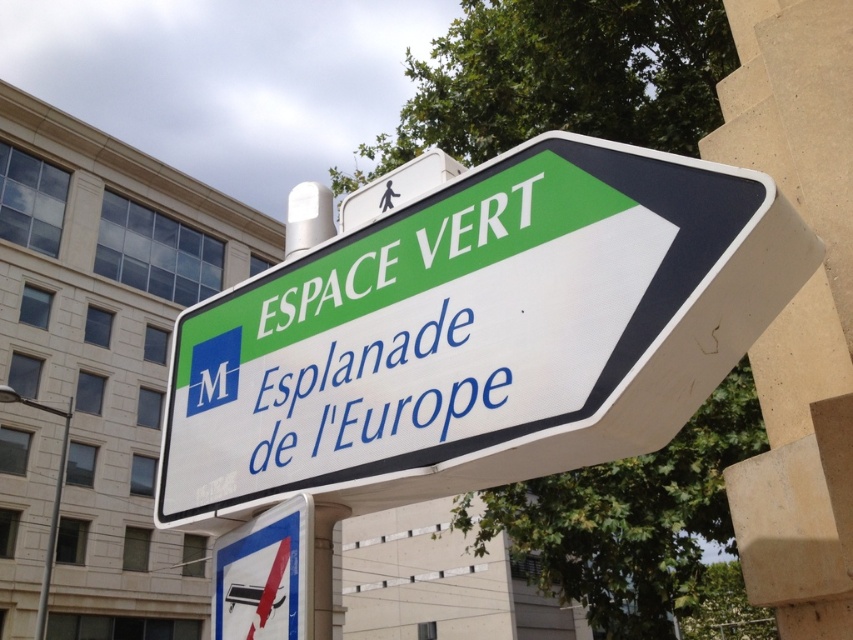
Is white plastic sign at center taller than white plastic sign at lower left?

Correct, white plastic sign at center is much taller as white plastic sign at lower left.

Can you confirm if white plastic sign at center is positioned above white plastic sign at lower left?

Correct, white plastic sign at center is located above white plastic sign at lower left.

Is point (506, 209) farther from viewer compared to point (213, 636)?

No, (506, 209) is in front of (213, 636).

Identify the location of white plastic sign at center. Image resolution: width=853 pixels, height=640 pixels. (479, 333).

Is white plastic sign at center positioned at the back of white paper sign at center?

No, it is in front of white paper sign at center.

Who is taller, white plastic sign at center or white paper sign at center?

Standing taller between the two is white plastic sign at center.

What do you see at coordinates (479, 333) in the screenshot? This screenshot has height=640, width=853. I see `white plastic sign at center` at bounding box center [479, 333].

The height and width of the screenshot is (640, 853). I want to click on white plastic sign at center, so click(479, 333).

Which is more to the right, white plastic sign at lower left or white plastic sign at upper center?

Positioned to the right is white plastic sign at upper center.

Is white plastic sign at lower left in front of white plastic sign at upper center?

That is False.

Is point (219, 634) in front of point (409, 177)?

Yes, it is in front of point (409, 177).

The height and width of the screenshot is (640, 853). What are the coordinates of `white plastic sign at lower left` in the screenshot? It's located at (265, 573).